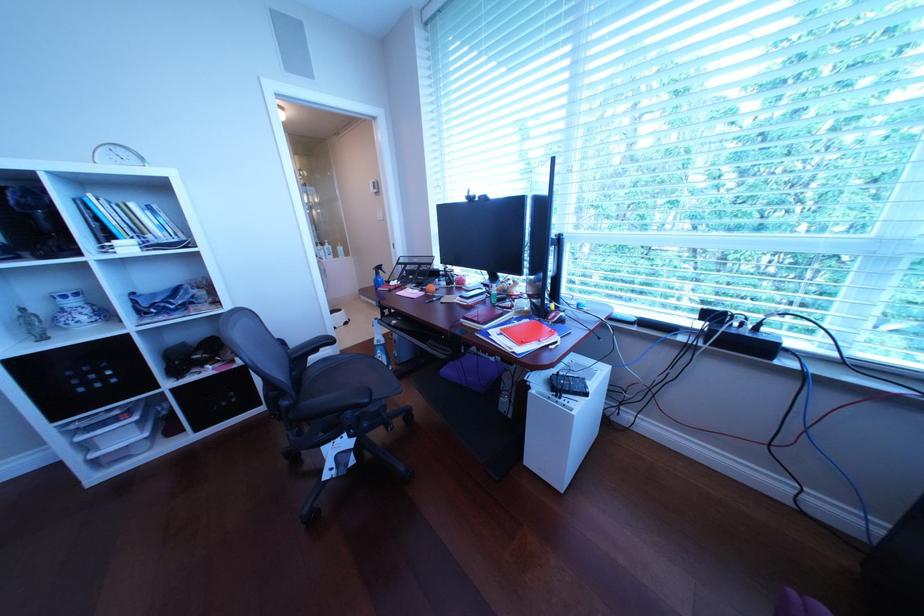
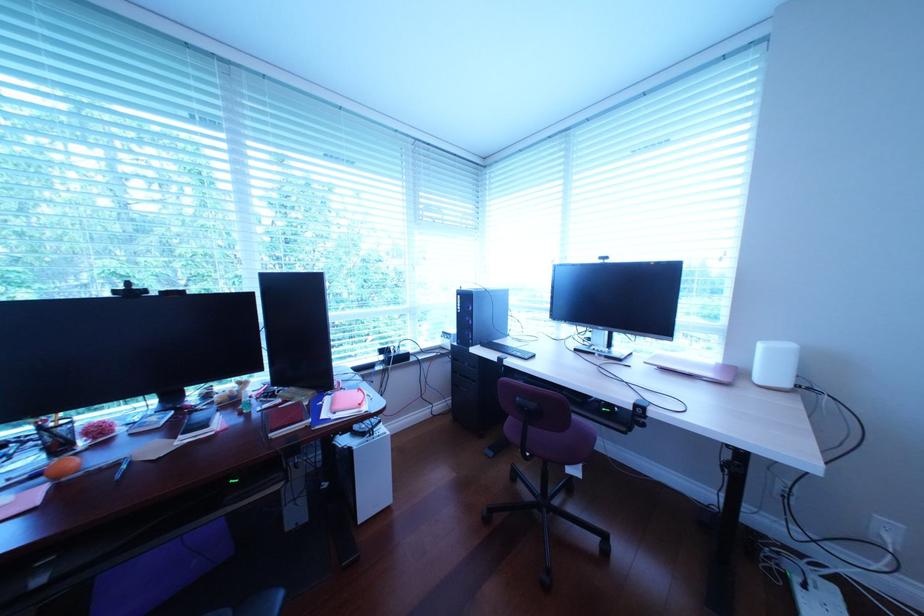
Question: The camera is either moving clockwise (left) or counter-clockwise (right) around the object. The first image is from the beginning of the video and the second image is from the end. Is the camera moving left or right when shooting the video?

Choices:
 (A) Left
 (B) Right

Answer: (A)